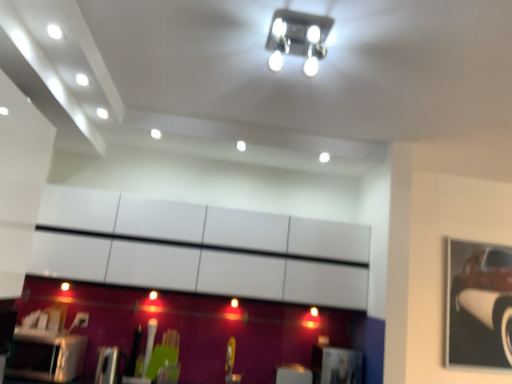
Question: Would you say metallic car at right is to the left or to the right of metallic silver toaster at lower left in the picture?

Choices:
 (A) left
 (B) right

Answer: (B)

Question: Looking at their shapes, would you say metallic car at right is wider or thinner than metallic silver toaster at lower left?

Choices:
 (A) wide
 (B) thin

Answer: (B)

Question: Estimate the real-world distances between objects in this image. Which object is closer to the metallic square light fixture at upper center?

Choices:
 (A) metallic silver toaster at lower left
 (B) metallic car at right

Answer: (A)

Question: Which of these objects is positioned farthest from the metallic square light fixture at upper center?

Choices:
 (A) metallic silver toaster at lower left
 (B) metallic car at right

Answer: (B)